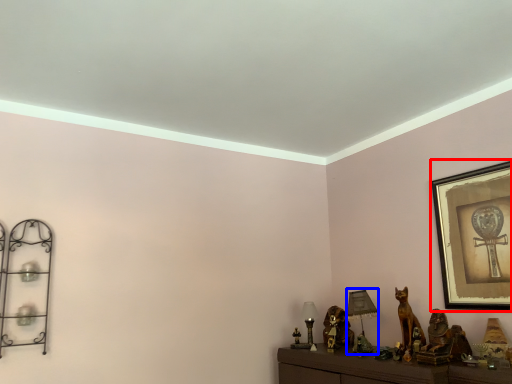
Question: Which point is closer to the camera, picture frame (highlighted by a red box) or table lamp (highlighted by a blue box)?

Choices:
 (A) picture frame
 (B) table lamp

Answer: (A)